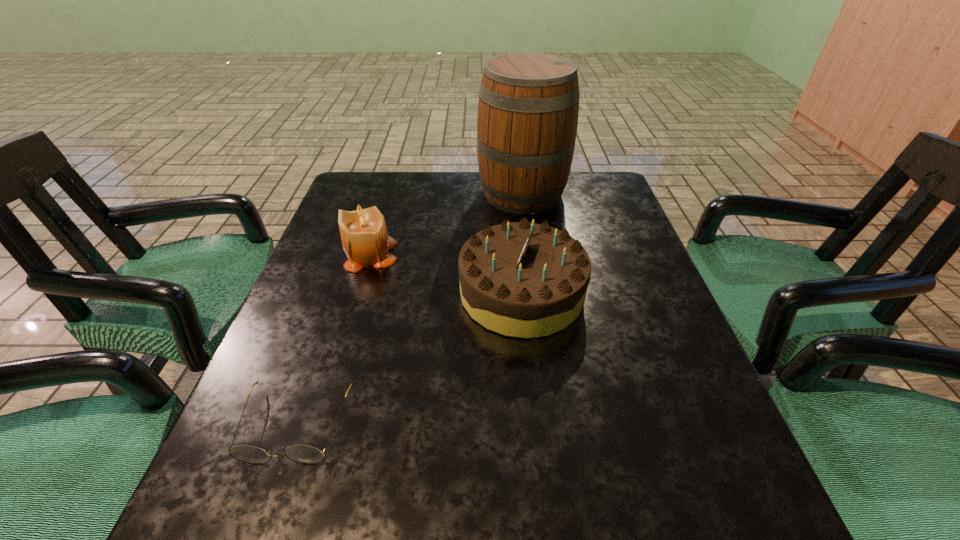
At what (x,y) coordinates should I click in order to perform the action: click on object that is the second closest to the birthday cake. Please return your answer as a coordinate pair (x, y). The width and height of the screenshot is (960, 540). Looking at the image, I should click on (528, 106).

Identify the location of free spot that satisfies the following two spatial constraints: 1. on the front side of the tallest object; 2. on the front-facing side of the birthday cake. This screenshot has width=960, height=540. (536, 293).

Where is `vacant space that satisfies the following two spatial constraints: 1. on the back side of the tallest object; 2. on the left side of the candle`? The image size is (960, 540). vacant space that satisfies the following two spatial constraints: 1. on the back side of the tallest object; 2. on the left side of the candle is located at coordinates (390, 193).

The width and height of the screenshot is (960, 540). Find the location of `free spot that satisfies the following two spatial constraints: 1. on the front-facing side of the birthday cake; 2. on the temples of the nearest object`. free spot that satisfies the following two spatial constraints: 1. on the front-facing side of the birthday cake; 2. on the temples of the nearest object is located at coordinates (536, 425).